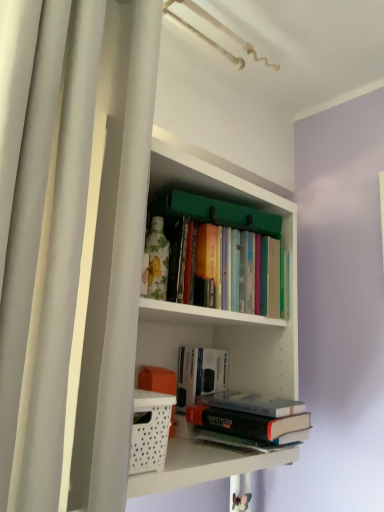
What is the approximate width of white matte shower curtain at left?

white matte shower curtain at left is 6.59 inches in width.

At what (x,y) coordinates should I click in order to perform the action: click on white matte bookshelf at center. Please return your answer as a coordinate pair (x, y). The height and width of the screenshot is (512, 384). Looking at the image, I should click on (221, 310).

Describe the element at coordinates (247, 423) in the screenshot. The width and height of the screenshot is (384, 512). I see `hardcover book at center, the third book when ordered from top to bottom` at that location.

Find the location of `hardcover books at center, the 1th book viewed from the top`. hardcover books at center, the 1th book viewed from the top is located at coordinates (216, 213).

Locate an element on the screen. Image resolution: width=384 pixels, height=512 pixels. hardcover book at center, arranged as the second book when viewed from the top is located at coordinates (200, 374).

Find the location of `white matte shower curtain at left`. white matte shower curtain at left is located at coordinates (71, 242).

How distant is hardcover books at center, the third book from the bottom, from white perforated basket at lower left?

The distance of hardcover books at center, the third book from the bottom, from white perforated basket at lower left is 42.58 centimeters.

From their relative heights in the image, would you say hardcover books at center, the 1th book viewed from the top, is taller or shorter than white perforated basket at lower left?

hardcover books at center, the 1th book viewed from the top, is taller than white perforated basket at lower left.

Which is correct: hardcover books at center, the third book from the bottom, is inside white perforated basket at lower left, or outside of it?

hardcover books at center, the third book from the bottom, cannot be found inside white perforated basket at lower left.

From a real-world perspective, which is physically below, hardcover books at center, the third book from the bottom, or white perforated basket at lower left?

white perforated basket at lower left is physically lower.

Which object is positioned more to the right, hardcover book at center, the third book when ordered from top to bottom, or white perforated basket at lower left?

hardcover book at center, the third book when ordered from top to bottom, is more to the right.

Is white perforated basket at lower left a part of hardcover book at center, the third book when ordered from top to bottom?

No.

How much distance is there between hardcover book at center, the first book ordered from the bottom, and white perforated basket at lower left?

They are 9.67 inches apart.

In the scene shown: From a real-world perspective, is hardcover book at center, the third book when ordered from top to bottom, located beneath white perforated basket at lower left?

Correct, in the physical world, hardcover book at center, the third book when ordered from top to bottom, is lower than white perforated basket at lower left.

Measure the distance from hardcover book at center, arranged as the second book when viewed from the top, to hardcover book at center, the third book when ordered from top to bottom.

hardcover book at center, arranged as the second book when viewed from the top, and hardcover book at center, the third book when ordered from top to bottom, are 5.97 inches apart from each other.

Where is `book behind the hardcover book at center, the first book ordered from the bottom`? book behind the hardcover book at center, the first book ordered from the bottom is located at coordinates (200, 374).

From the image's perspective, which object appears higher, hardcover book at center, arranged as the second book when viewed from the top, or hardcover book at center, the third book when ordered from top to bottom?

From the image's view, hardcover book at center, arranged as the second book when viewed from the top, is above.

Which is behind, point (185, 374) or point (244, 418)?

The point (185, 374) is farther.

Is white matte shower curtain at left beside hardcover book at center, the third book when ordered from top to bottom?

No, white matte shower curtain at left is not with hardcover book at center, the third book when ordered from top to bottom.

Is hardcover book at center, the third book when ordered from top to bottom, a part of white matte shower curtain at left?

No, hardcover book at center, the third book when ordered from top to bottom, is not a part of white matte shower curtain at left.

Can you confirm if white matte shower curtain at left is positioned to the left of hardcover book at center, the third book when ordered from top to bottom?

Indeed, white matte shower curtain at left is positioned on the left side of hardcover book at center, the third book when ordered from top to bottom.

Can you confirm if white matte shower curtain at left is smaller than hardcover book at center, the third book when ordered from top to bottom?

No, white matte shower curtain at left is not smaller than hardcover book at center, the third book when ordered from top to bottom.

Can you confirm if hardcover book at center, the third book when ordered from top to bottom, is shorter than hardcover book at center, the 2th book positioned from the bottom?

Yes, hardcover book at center, the third book when ordered from top to bottom, is shorter than hardcover book at center, the 2th book positioned from the bottom.

Considering the sizes of objects hardcover book at center, the third book when ordered from top to bottom, and hardcover book at center, arranged as the second book when viewed from the top, in the image provided, who is bigger, hardcover book at center, the third book when ordered from top to bottom, or hardcover book at center, arranged as the second book when viewed from the top,?

With larger size is hardcover book at center, the third book when ordered from top to bottom.

Is hardcover book at center, the first book ordered from the bottom, far from hardcover book at center, arranged as the second book when viewed from the top?

No.

From the image's perspective, relative to hardcover book at center, the 2th book positioned from the bottom, is hardcover book at center, the first book ordered from the bottom, above or below?

hardcover book at center, the first book ordered from the bottom, is situated lower than hardcover book at center, the 2th book positioned from the bottom, in the image.

Looking at this image, based on their positions, is white matte bookshelf at center located to the left or right of hardcover book at center, the 2th book positioned from the bottom?

Clearly, white matte bookshelf at center is on the left of hardcover book at center, the 2th book positioned from the bottom, in the image.

Is point (280, 361) closer to camera compared to point (227, 368)?

Yes.

Measure the distance from white matte bookshelf at center to hardcover book at center, arranged as the second book when viewed from the top.

white matte bookshelf at center and hardcover book at center, arranged as the second book when viewed from the top, are 18.87 centimeters apart.

Considering the positions of objects white matte bookshelf at center and hardcover book at center, the 2th book positioned from the bottom, in the image provided, who is behind, white matte bookshelf at center or hardcover book at center, the 2th book positioned from the bottom,?

hardcover book at center, the 2th book positioned from the bottom, is behind.

From the image's perspective, which one is positioned higher, white matte shower curtain at left or white matte bookshelf at center?

white matte shower curtain at left, from the image's perspective.

Is white matte shower curtain at left next to white matte bookshelf at center and touching it?

No, white matte shower curtain at left is not beside white matte bookshelf at center.

Considering the sizes of white matte shower curtain at left and white matte bookshelf at center in the image, is white matte shower curtain at left bigger or smaller than white matte bookshelf at center?

Considering their sizes, white matte shower curtain at left takes up less space than white matte bookshelf at center.

Can you confirm if white matte shower curtain at left is wider than white matte bookshelf at center?

No, white matte shower curtain at left is not wider than white matte bookshelf at center.

At what (x,y) coordinates should I click in order to perform the action: click on basket below the hardcover books at center, the 1th book viewed from the top (from the image's perspective). Please return your answer as a coordinate pair (x, y). Looking at the image, I should click on (150, 430).

Which book is the 2nd one when counting from the back of the white perforated basket at lower left? Please provide its 2D coordinates.

[(247, 423)]

Considering their positions, is hardcover books at center, the third book from the bottom, positioned closer to hardcover book at center, the third book when ordered from top to bottom, than white perforated basket at lower left?

Based on the image, white perforated basket at lower left appears to be nearer to hardcover book at center, the third book when ordered from top to bottom.

Estimate the real-world distances between objects in this image. Which object is closer to hardcover book at center, arranged as the second book when viewed from the top, hardcover books at center, the 1th book viewed from the top, or white matte shower curtain at left?

Based on the image, hardcover books at center, the 1th book viewed from the top, appears to be nearer to hardcover book at center, arranged as the second book when viewed from the top.

When comparing their distances from hardcover books at center, the third book from the bottom, does white perforated basket at lower left or hardcover book at center, arranged as the second book when viewed from the top, seem further?

white perforated basket at lower left lies further to hardcover books at center, the third book from the bottom, than the other object.

Which object lies further to the anchor point white perforated basket at lower left, white matte bookshelf at center or white matte shower curtain at left?

Among the two, white matte shower curtain at left is located further to white perforated basket at lower left.

From the image, which object appears to be nearer to hardcover book at center, the first book ordered from the bottom, white matte shower curtain at left or white perforated basket at lower left?

white perforated basket at lower left is positioned closer to the anchor hardcover book at center, the first book ordered from the bottom.

When comparing their distances from hardcover books at center, the third book from the bottom, does white matte bookshelf at center or white matte shower curtain at left seem closer?

The object closer to hardcover books at center, the third book from the bottom, is white matte bookshelf at center.

Estimate the real-world distances between objects in this image. Which object is closer to hardcover books at center, the 1th book viewed from the top, white matte bookshelf at center or white perforated basket at lower left?

Among the two, white matte bookshelf at center is located nearer to hardcover books at center, the 1th book viewed from the top.

Considering their positions, is hardcover books at center, the 1th book viewed from the top, positioned further to white perforated basket at lower left than white matte shower curtain at left?

hardcover books at center, the 1th book viewed from the top, is further to white perforated basket at lower left.

Locate an element on the screen. This screenshot has width=384, height=512. book between white matte shower curtain at left and hardcover book at center, the third book when ordered from top to bottom, from front to back is located at coordinates (216, 213).

Find the location of `shelf that lies between hardcover books at center, the third book from the bottom, and hardcover book at center, the third book when ordered from top to bottom, from top to bottom`. shelf that lies between hardcover books at center, the third book from the bottom, and hardcover book at center, the third book when ordered from top to bottom, from top to bottom is located at coordinates (221, 310).

Find the location of a particular element. The height and width of the screenshot is (512, 384). shelf positioned between white matte shower curtain at left and hardcover books at center, the third book from the bottom, from near to far is located at coordinates (221, 310).

Where is `basket located between white matte shower curtain at left and hardcover book at center, arranged as the second book when viewed from the top, in the depth direction`? This screenshot has width=384, height=512. basket located between white matte shower curtain at left and hardcover book at center, arranged as the second book when viewed from the top, in the depth direction is located at coordinates (150, 430).